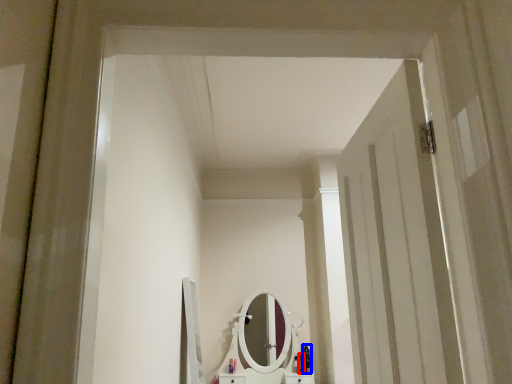
Question: Which point is further to the camera, toiletry (highlighted by a red box) or toiletry (highlighted by a blue box)?

Choices:
 (A) toiletry
 (B) toiletry

Answer: (B)